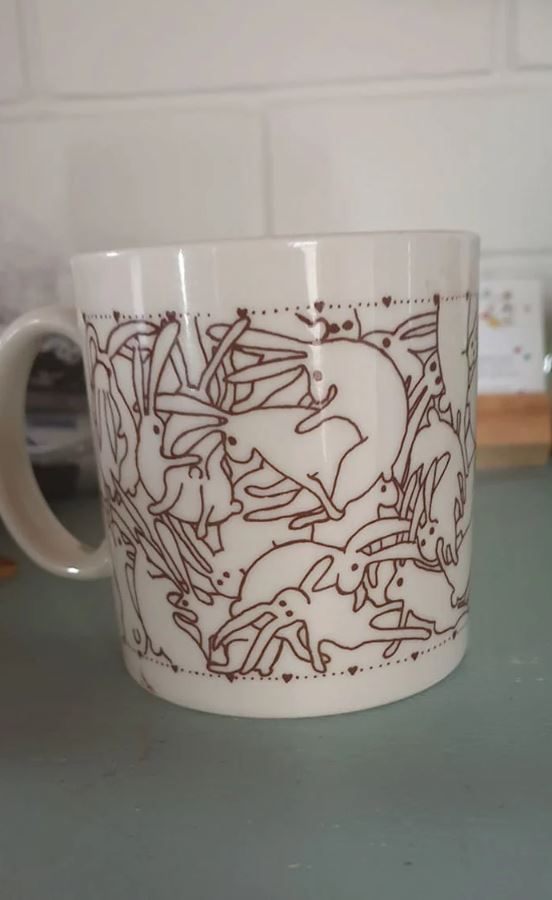
At what (x,y) coordinates should I click in order to perform the action: click on white tile. Please return your answer as a coordinate pair (x, y). Image resolution: width=552 pixels, height=900 pixels. Looking at the image, I should click on (320, 186), (180, 145), (177, 75).